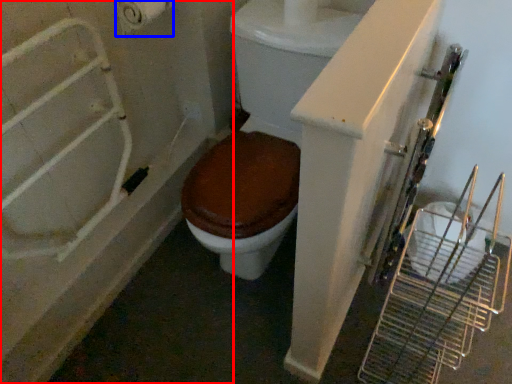
Question: Which object is closer to the camera taking this photo, bath (highlighted by a red box) or toilet paper (highlighted by a blue box)?

Choices:
 (A) bath
 (B) toilet paper

Answer: (A)